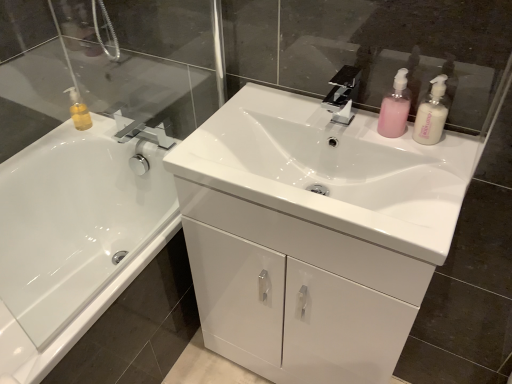
The height and width of the screenshot is (384, 512). Describe the element at coordinates (332, 170) in the screenshot. I see `white glossy sink at center` at that location.

Looking at this image, in order to face white glossy cabinet at center, should I rotate leftwards or rightwards?

To face it directly, rotate right by 7.213 degrees.

The image size is (512, 384). What do you see at coordinates (296, 292) in the screenshot? I see `white glossy cabinet at center` at bounding box center [296, 292].

What is the approximate height of black glossy faucet at center?

black glossy faucet at center is 4.41 inches tall.

The height and width of the screenshot is (384, 512). I want to click on black glossy faucet at center, so click(x=343, y=94).

This screenshot has width=512, height=384. What do you see at coordinates (75, 222) in the screenshot? I see `white glossy bathtub at left` at bounding box center [75, 222].

The image size is (512, 384). I want to click on white glossy bathtub at left, so click(75, 222).

Where is `pink plastic pump bottle at upper right, the 3th toiletry positioned from the back`? This screenshot has width=512, height=384. pink plastic pump bottle at upper right, the 3th toiletry positioned from the back is located at coordinates (431, 114).

Identify the location of translucent plastic soap dispenser at upper left, which is the 1th toiletry from back to front. This screenshot has width=512, height=384. (79, 111).

Where is `white glossy sink at center`? This screenshot has height=384, width=512. white glossy sink at center is located at coordinates (332, 170).

Image resolution: width=512 pixels, height=384 pixels. Find the location of `sink that appears below the pink matte pump bottle at upper right, acting as the second toiletry starting from the left (from a real-world perspective)`. sink that appears below the pink matte pump bottle at upper right, acting as the second toiletry starting from the left (from a real-world perspective) is located at coordinates (332, 170).

Does pink matte pump bottle at upper right, which appears as the second toiletry when viewed from the back, touch white glossy sink at center?

No, pink matte pump bottle at upper right, which appears as the second toiletry when viewed from the back, is not touching white glossy sink at center.

Which is more to the left, pink matte pump bottle at upper right, the 2th toiletry positioned from the front, or white glossy sink at center?

white glossy sink at center.

Who is bigger, pink matte pump bottle at upper right, which is the 2th toiletry in right-to-left order, or white glossy sink at center?

Bigger between the two is white glossy sink at center.

Is point (409, 131) more distant than point (85, 108)?

No, it is in front of (85, 108).

Is white glossy sink at center taller than translucent plastic soap dispenser at upper left, which is the 1th toiletry from back to front?

Incorrect, the height of white glossy sink at center is not larger of that of translucent plastic soap dispenser at upper left, which is the 1th toiletry from back to front.

Looking at this image, choose the correct answer: Is white glossy sink at center inside translucent plastic soap dispenser at upper left, arranged as the 3th toiletry when viewed from the right, or outside it?

white glossy sink at center is outside translucent plastic soap dispenser at upper left, arranged as the 3th toiletry when viewed from the right.

Where is `sink on the right of translucent plastic soap dispenser at upper left, which appears as the 1th toiletry when viewed from the left`? The height and width of the screenshot is (384, 512). sink on the right of translucent plastic soap dispenser at upper left, which appears as the 1th toiletry when viewed from the left is located at coordinates (332, 170).

From the image's perspective, does black glossy faucet at center appear lower than pink plastic pump bottle at upper right, marked as the 1th toiletry in a right-to-left arrangement?

No, from the image's perspective, black glossy faucet at center is not beneath pink plastic pump bottle at upper right, marked as the 1th toiletry in a right-to-left arrangement.

Does black glossy faucet at center come behind pink plastic pump bottle at upper right, the 3th toiletry positioned from the back?

Yes, black glossy faucet at center is further from the camera.

Is black glossy faucet at center spatially inside pink plastic pump bottle at upper right, the 3th toiletry positioned from the back, or outside of it?

black glossy faucet at center is not inside pink plastic pump bottle at upper right, the 3th toiletry positioned from the back, it's outside.

Can you tell me how much black glossy faucet at center and pink plastic pump bottle at upper right, marked as the 1th toiletry in a right-to-left arrangement, differ in facing direction?

There is a 0.207-degree angle between the facing directions of black glossy faucet at center and pink plastic pump bottle at upper right, marked as the 1th toiletry in a right-to-left arrangement.

From the image's perspective, is translucent plastic soap dispenser at upper left, arranged as the 3th toiletry when viewed from the right, located above or below white glossy bathtub at left?

translucent plastic soap dispenser at upper left, arranged as the 3th toiletry when viewed from the right, is situated higher than white glossy bathtub at left in the image.

Which object is closer to the camera, translucent plastic soap dispenser at upper left, arranged as the 3th toiletry when viewed from the right, or white glossy bathtub at left?

white glossy bathtub at left is in front.

How many degrees apart are the facing directions of translucent plastic soap dispenser at upper left, which is the 1th toiletry from back to front, and white glossy bathtub at left?

90.6 degrees separate the facing orientations of translucent plastic soap dispenser at upper left, which is the 1th toiletry from back to front, and white glossy bathtub at left.

Is point (70, 94) positioned before point (101, 299)?

No.

Where is `the 2nd toiletry above when counting from the white glossy bathtub at left (from the image's perspective)`? the 2nd toiletry above when counting from the white glossy bathtub at left (from the image's perspective) is located at coordinates (395, 107).

Considering the positions of objects white glossy bathtub at left and pink matte pump bottle at upper right, the 2th toiletry positioned from the front, in the image provided, who is more to the left, white glossy bathtub at left or pink matte pump bottle at upper right, the 2th toiletry positioned from the front,?

white glossy bathtub at left.

Based on the photo, how much distance is there between white glossy bathtub at left and pink matte pump bottle at upper right, which appears as the second toiletry when viewed from the back?

white glossy bathtub at left and pink matte pump bottle at upper right, which appears as the second toiletry when viewed from the back, are 3.35 feet apart from each other.

Consider the image. Considering the relative sizes of white glossy bathtub at left and pink matte pump bottle at upper right, which appears as the second toiletry when viewed from the back, in the image provided, is white glossy bathtub at left taller than pink matte pump bottle at upper right, which appears as the second toiletry when viewed from the back,?

Indeed, white glossy bathtub at left has a greater height compared to pink matte pump bottle at upper right, which appears as the second toiletry when viewed from the back.

You are a GUI agent. You are given a task and a screenshot of the screen. Output one action in this format:
    pyautogui.click(x=<x>, y=<y>)
    Task: Click on the bathroom cabinet in front of the pink plastic pump bottle at upper right, arranged as the 3th toiletry when viewed from the left
    
    Given the screenshot: What is the action you would take?
    pyautogui.click(x=296, y=292)

Consider the image. From the image's perspective, is pink plastic pump bottle at upper right, marked as the 1th toiletry in a right-to-left arrangement, above or below white glossy cabinet at center?

From the image's perspective, pink plastic pump bottle at upper right, marked as the 1th toiletry in a right-to-left arrangement, appears above white glossy cabinet at center.

Is pink plastic pump bottle at upper right, marked as the 1th toiletry in a right-to-left arrangement, shorter than white glossy cabinet at center?

Yes.

Looking at the image, does pink plastic pump bottle at upper right, marked as the 1th toiletry in a right-to-left arrangement, seem bigger or smaller compared to white glossy cabinet at center?

pink plastic pump bottle at upper right, marked as the 1th toiletry in a right-to-left arrangement, is smaller than white glossy cabinet at center.

Consider the image. How far apart are pink plastic pump bottle at upper right, which ranks as the first toiletry in front-to-back order, and translucent plastic soap dispenser at upper left, which is the 1th toiletry from back to front?

pink plastic pump bottle at upper right, which ranks as the first toiletry in front-to-back order, is 36.00 inches away from translucent plastic soap dispenser at upper left, which is the 1th toiletry from back to front.

The height and width of the screenshot is (384, 512). What are the coordinates of `the 2nd toiletry above the pink plastic pump bottle at upper right, arranged as the 3th toiletry when viewed from the left (from the image's perspective)` in the screenshot? It's located at (79, 111).

Does pink plastic pump bottle at upper right, marked as the 1th toiletry in a right-to-left arrangement, have a greater width compared to translucent plastic soap dispenser at upper left, arranged as the 3th toiletry when viewed from the right?

No.

Locate an element on the screen. This screenshot has height=384, width=512. sink below the pink matte pump bottle at upper right, the 2th toiletry positioned from the front (from a real-world perspective) is located at coordinates (332, 170).

Where is `the 3rd toiletry above the white glossy sink at center (from the image's perspective)`? This screenshot has width=512, height=384. the 3rd toiletry above the white glossy sink at center (from the image's perspective) is located at coordinates (79, 111).

Estimate the real-world distances between objects in this image. Which object is closer to white glossy sink at center, white glossy cabinet at center or white glossy bathtub at left?

Among the two, white glossy cabinet at center is located nearer to white glossy sink at center.

Looking at the image, which one is located further to white glossy bathtub at left, pink plastic pump bottle at upper right, which ranks as the first toiletry in front-to-back order, or white glossy cabinet at center?

pink plastic pump bottle at upper right, which ranks as the first toiletry in front-to-back order, is further to white glossy bathtub at left.

Considering their positions, is translucent plastic soap dispenser at upper left, which is the 1th toiletry from back to front, positioned further to pink plastic pump bottle at upper right, which ranks as the first toiletry in front-to-back order, than black glossy faucet at center?

translucent plastic soap dispenser at upper left, which is the 1th toiletry from back to front.

Which object lies nearer to the anchor point translucent plastic soap dispenser at upper left, which appears as the 1th toiletry when viewed from the left, black glossy faucet at center or white glossy sink at center?

The object closer to translucent plastic soap dispenser at upper left, which appears as the 1th toiletry when viewed from the left, is white glossy sink at center.

Looking at the image, which one is located further to pink matte pump bottle at upper right, which appears as the second toiletry when viewed from the back, white glossy bathtub at left or white glossy sink at center?

white glossy bathtub at left is further to pink matte pump bottle at upper right, which appears as the second toiletry when viewed from the back.

From the image, which object appears to be farther from black glossy faucet at center, pink plastic pump bottle at upper right, which ranks as the first toiletry in front-to-back order, or pink matte pump bottle at upper right, acting as the second toiletry starting from the left?

The object further to black glossy faucet at center is pink plastic pump bottle at upper right, which ranks as the first toiletry in front-to-back order.

Which object lies further to the anchor point white glossy sink at center, white glossy cabinet at center or pink matte pump bottle at upper right, which is the 2th toiletry in right-to-left order?

pink matte pump bottle at upper right, which is the 2th toiletry in right-to-left order, lies further to white glossy sink at center than the other object.

Estimate the real-world distances between objects in this image. Which object is closer to pink matte pump bottle at upper right, which is the 2th toiletry in right-to-left order, white glossy bathtub at left or pink plastic pump bottle at upper right, arranged as the 3th toiletry when viewed from the left?

pink plastic pump bottle at upper right, arranged as the 3th toiletry when viewed from the left, lies closer to pink matte pump bottle at upper right, which is the 2th toiletry in right-to-left order, than the other object.

Where is `toiletry located between white glossy bathtub at left and pink plastic pump bottle at upper right, marked as the 1th toiletry in a right-to-left arrangement, in the left-right direction`? toiletry located between white glossy bathtub at left and pink plastic pump bottle at upper right, marked as the 1th toiletry in a right-to-left arrangement, in the left-right direction is located at coordinates (395, 107).

The width and height of the screenshot is (512, 384). I want to click on sink between translucent plastic soap dispenser at upper left, which appears as the 1th toiletry when viewed from the left, and white glossy cabinet at center from left to right, so click(x=332, y=170).

This screenshot has width=512, height=384. What are the coordinates of `sink situated between translucent plastic soap dispenser at upper left, arranged as the 3th toiletry when viewed from the right, and pink matte pump bottle at upper right, which is the 2th toiletry in right-to-left order, from left to right` in the screenshot? It's located at (332, 170).

Find the location of `bathroom cabinet between white glossy bathtub at left and black glossy faucet at center in the horizontal direction`. bathroom cabinet between white glossy bathtub at left and black glossy faucet at center in the horizontal direction is located at coordinates (296, 292).